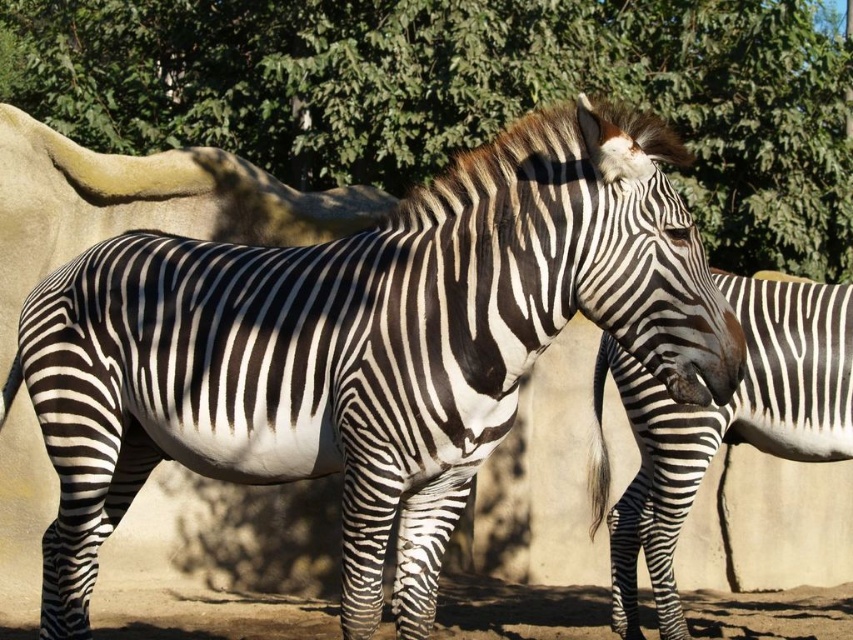
Is green leafy tree at upper center shorter than brown soil at lower center?

No, green leafy tree at upper center is not shorter than brown soil at lower center.

Is point (764, 92) behind point (599, 627)?

Yes, point (764, 92) is behind point (599, 627).

Locate an element on the screen. The width and height of the screenshot is (853, 640). green leafy tree at upper center is located at coordinates (462, 92).

The image size is (853, 640). What do you see at coordinates (462, 92) in the screenshot?
I see `green leafy tree at upper center` at bounding box center [462, 92].

Does green leafy tree at upper center have a lesser height compared to black and white striped zebra at center?

Yes.

Is point (422, 80) behind point (741, 276)?

Yes, point (422, 80) is farther from viewer.

What are the coordinates of `green leafy tree at upper center` in the screenshot? It's located at (462, 92).

Consider the image. Does black and white striped zebra at center appear over brown soil at lower center?

Yes.

Is black and white striped zebra at center thinner than brown soil at lower center?

Yes, black and white striped zebra at center is thinner than brown soil at lower center.

Between point (811, 381) and point (4, 636), which one is positioned in front?

Point (811, 381)

You are a GUI agent. You are given a task and a screenshot of the screen. Output one action in this format:
    pyautogui.click(x=<x>, y=<y>)
    Task: Click on the black and white striped zebra at center
    
    Given the screenshot: What is the action you would take?
    pyautogui.click(x=718, y=428)